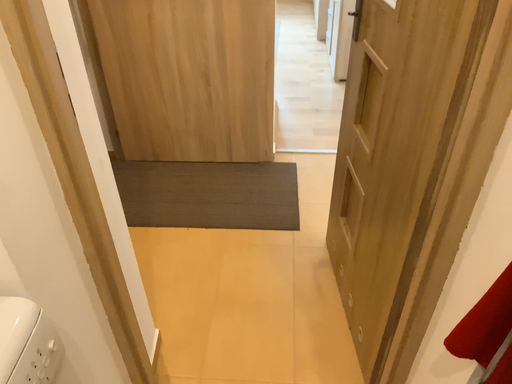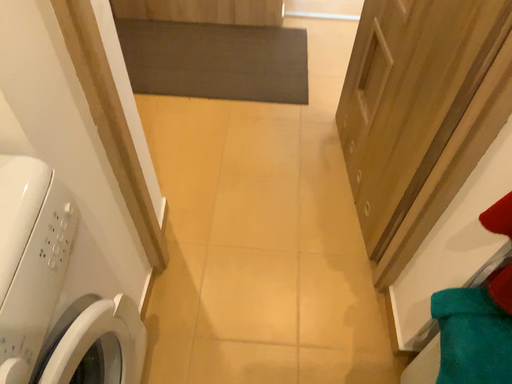
Question: Which way did the camera rotate in the video?

Choices:
 (A) rotated downward
 (B) rotated upward

Answer: (A)